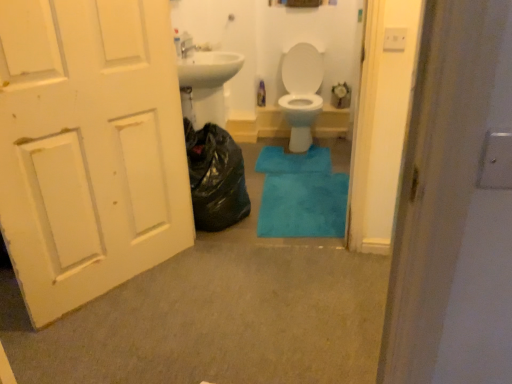
Image resolution: width=512 pixels, height=384 pixels. What are the coordinates of `unoccupied region to the right of white painted wood door at left` in the screenshot? It's located at (208, 288).